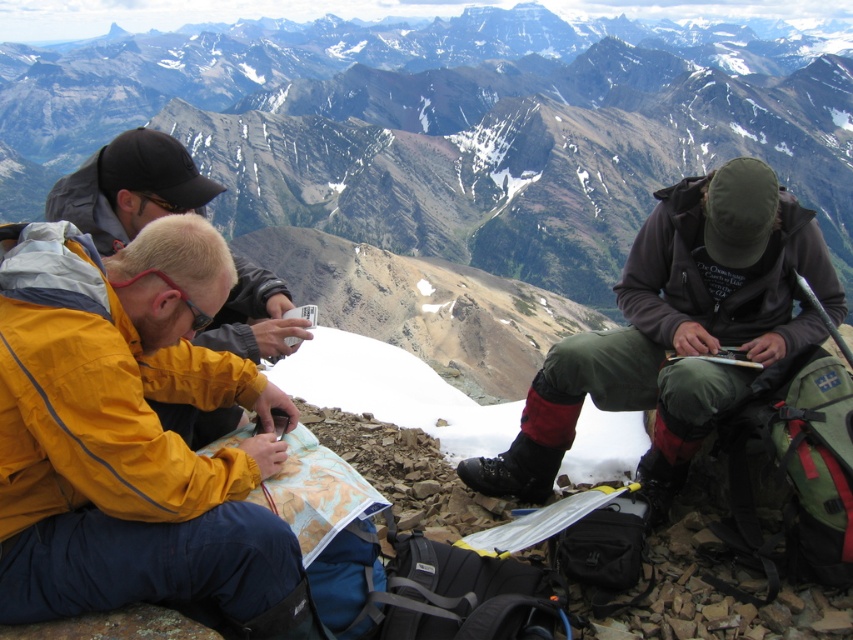
Question: Which object is the farthest from the dark brown jacket at right?

Choices:
 (A) yellow waterproof jacket at lower left
 (B) rocky mountain range at center

Answer: (B)

Question: Estimate the real-world distances between objects in this image. Which object is closer to the yellow waterproof jacket at lower left?

Choices:
 (A) dark brown jacket at right
 (B) rocky mountain range at center

Answer: (A)

Question: Considering the relative positions of rocky mountain range at center and yellow waterproof jacket at lower left in the image provided, where is rocky mountain range at center located with respect to yellow waterproof jacket at lower left?

Choices:
 (A) right
 (B) left

Answer: (A)

Question: Which object is the farthest from the rocky mountain range at center?

Choices:
 (A) dark brown jacket at right
 (B) yellow waterproof jacket at lower left

Answer: (A)

Question: Is the position of rocky mountain range at center more distant than that of yellow waterproof jacket at lower left?

Choices:
 (A) yes
 (B) no

Answer: (A)

Question: Observing the image, what is the correct spatial positioning of rocky mountain range at center in reference to dark brown jacket at right?

Choices:
 (A) right
 (B) left

Answer: (A)